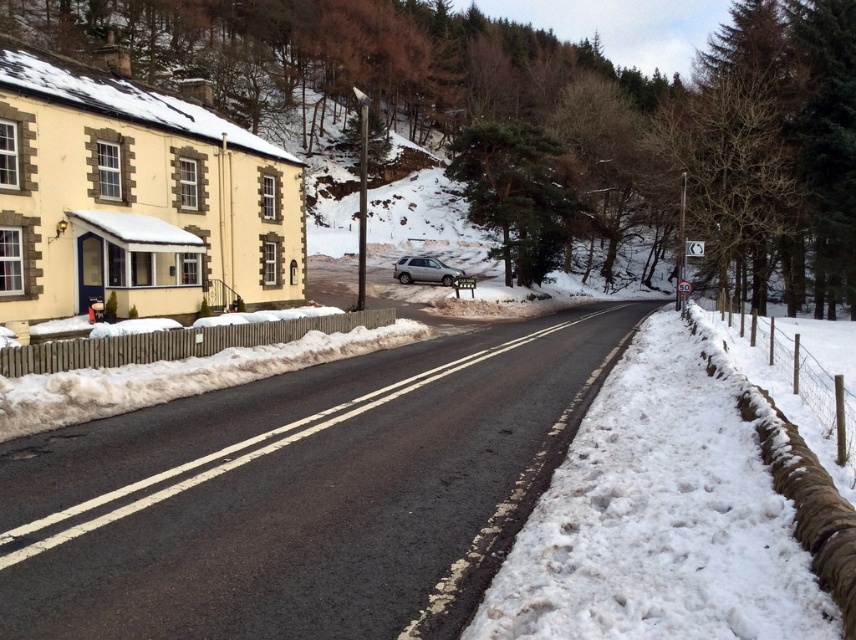
You are driving a car and see the satin silver suv at center ahead on the road. There is white fluffy snow at road right near the road. Do you think the snow is under the SUV or behind it?

The white fluffy snow at road right is below satin silver suv at center, so the snow is under the SUV.

You are standing at the starting point of the road in the winter scene. There are two points marked on the road ahead of you. Which point is closer to you, point (x=724, y=372) or point (x=399, y=280)?

Point (x=724, y=372) is closer to the viewer than point (x=399, y=280).

You are standing at the starting point of the road and want to reach the snow at road right located at point (663, 515). Which direction should you walk to get there?

You should walk towards the right side of the road to reach the white fluffy snow at road right located at point (663, 515).